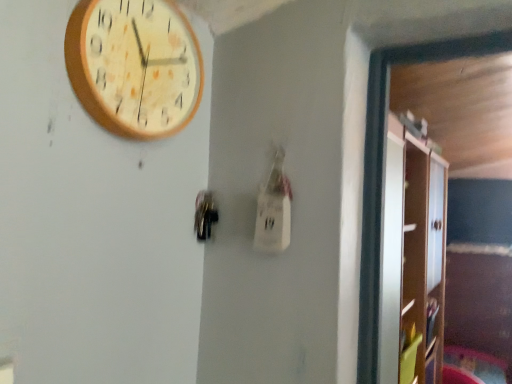
Question: Does wooden clock at upper left appear on the right side of white glossy cabinet at right?

Choices:
 (A) no
 (B) yes

Answer: (A)

Question: Considering the relative sizes of wooden clock at upper left and white glossy cabinet at right in the image provided, is wooden clock at upper left taller than white glossy cabinet at right?

Choices:
 (A) yes
 (B) no

Answer: (B)

Question: Would you consider wooden clock at upper left to be distant from white glossy cabinet at right?

Choices:
 (A) no
 (B) yes

Answer: (B)

Question: Is wooden clock at upper left bigger than white glossy cabinet at right?

Choices:
 (A) yes
 (B) no

Answer: (B)

Question: Is wooden clock at upper left touching white glossy cabinet at right?

Choices:
 (A) no
 (B) yes

Answer: (A)

Question: Is wooden clock at upper left bigger or smaller than metallic dark gray door handle at center?

Choices:
 (A) small
 (B) big

Answer: (B)

Question: Does point (86, 72) appear closer or farther from the camera than point (206, 238)?

Choices:
 (A) farther
 (B) closer

Answer: (B)

Question: From a real-world perspective, is wooden clock at upper left physically located above or below metallic dark gray door handle at center?

Choices:
 (A) above
 (B) below

Answer: (A)

Question: From the image's perspective, is wooden clock at upper left positioned above or below metallic dark gray door handle at center?

Choices:
 (A) below
 (B) above

Answer: (B)

Question: From their relative heights in the image, would you say wooden clock at upper left is taller or shorter than white glossy cabinet at right?

Choices:
 (A) short
 (B) tall

Answer: (A)

Question: Considering the relative positions of wooden clock at upper left and white glossy cabinet at right in the image provided, is wooden clock at upper left to the left or to the right of white glossy cabinet at right?

Choices:
 (A) right
 (B) left

Answer: (B)

Question: Considering the positions of wooden clock at upper left and white glossy cabinet at right in the image, is wooden clock at upper left wider or thinner than white glossy cabinet at right?

Choices:
 (A) wide
 (B) thin

Answer: (B)

Question: From a real-world perspective, is wooden clock at upper left positioned above or below white glossy cabinet at right?

Choices:
 (A) below
 (B) above

Answer: (B)

Question: From a real-world perspective, relative to wooden clock at upper left, is metallic dark gray door handle at center vertically above or below?

Choices:
 (A) above
 (B) below

Answer: (B)

Question: Considering the positions of metallic dark gray door handle at center and wooden clock at upper left in the image, is metallic dark gray door handle at center bigger or smaller than wooden clock at upper left?

Choices:
 (A) big
 (B) small

Answer: (B)